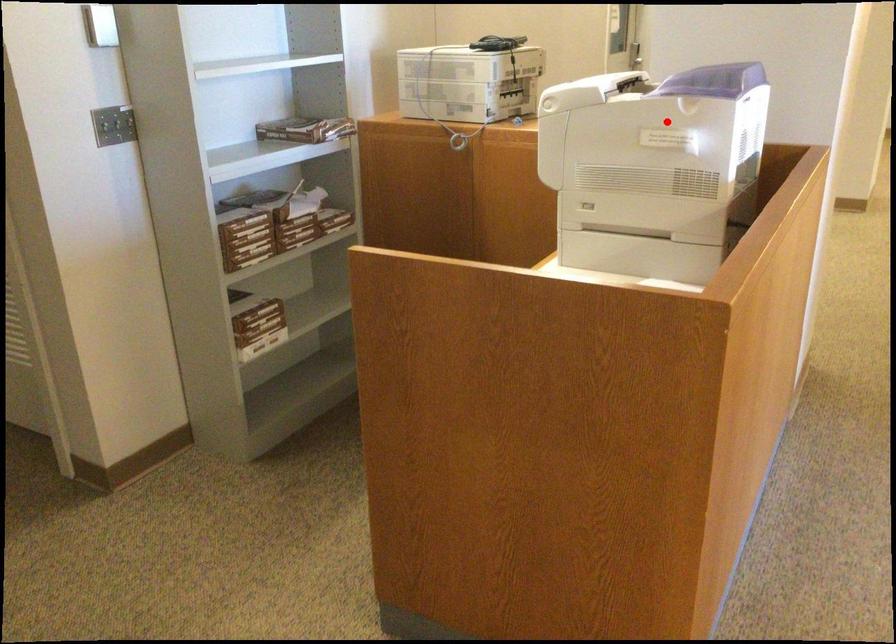
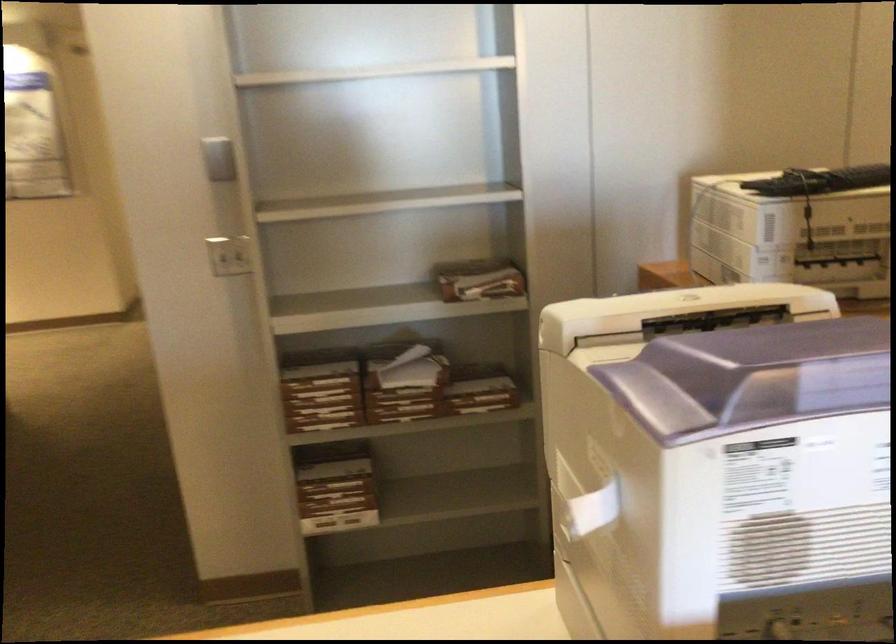
Question: A red point is marked in image1. In image2, is the corresponding 3D point closer to the camera or farther? Reply with the corresponding letter.

Choices:
 (A) The corresponding 3D point is closer.
 (B) The corresponding 3D point is farther.

Answer: (A)